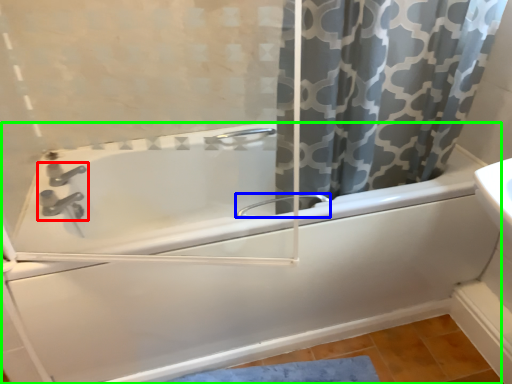
Question: Based on their relative distances, which object is nearer to tap (highlighted by a red box)? Choose from faucet (highlighted by a blue box) and bathtub (highlighted by a green box).

Choices:
 (A) faucet
 (B) bathtub

Answer: (B)